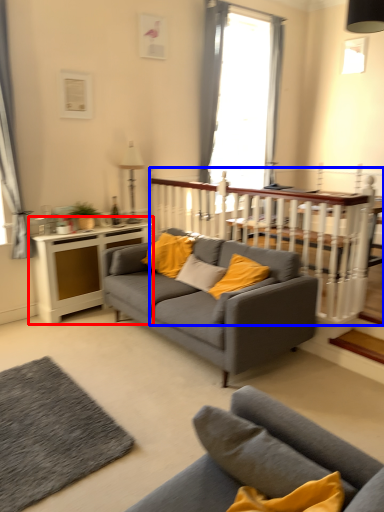
Question: Among these objects, which one is farthest to the camera, table (highlighted by a red box) or balustrade (highlighted by a blue box)?

Choices:
 (A) table
 (B) balustrade

Answer: (A)